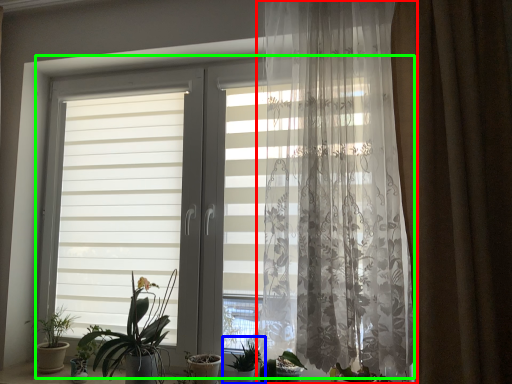
Question: Based on their relative distances, which object is nearer to curtain (highlighted by a red box)? Choose from houseplant (highlighted by a blue box) and window (highlighted by a green box).

Choices:
 (A) houseplant
 (B) window

Answer: (B)